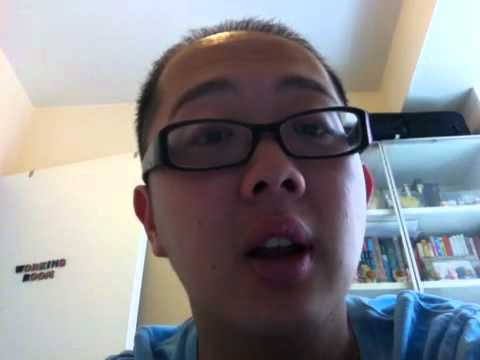
The image size is (480, 360). In order to click on items on book shelf in this screenshot , I will do `click(386, 256)`, `click(433, 243)`.